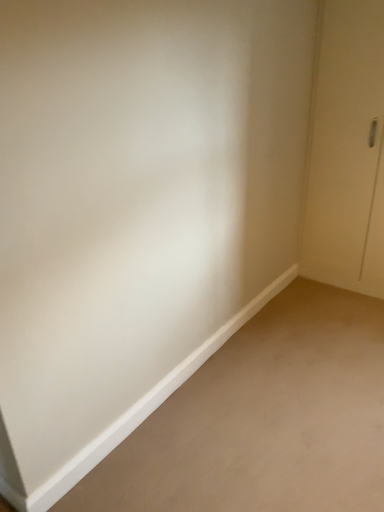
Measure the distance between point (182, 467) and camera.

The depth of point (182, 467) is 5.98 feet.

Locate an element on the screen. white matte baseboard at lower left is located at coordinates (264, 419).

What do you see at coordinates (264, 419) in the screenshot? Image resolution: width=384 pixels, height=512 pixels. I see `white matte baseboard at lower left` at bounding box center [264, 419].

In order to face white matte baseboard at lower left, should I rotate leftwards or rightwards?

You should rotate right by 11.685 degrees.

The image size is (384, 512). What do you see at coordinates (347, 151) in the screenshot?
I see `white matte door at right` at bounding box center [347, 151].

Locate an element on the screen. The image size is (384, 512). white matte door at right is located at coordinates (347, 151).

Locate an element on the screen. Image resolution: width=384 pixels, height=512 pixels. white matte baseboard at lower left is located at coordinates (264, 419).

Considering the relative positions of white matte baseboard at lower left and white matte door at right in the image provided, is white matte baseboard at lower left to the left of white matte door at right from the viewer's perspective?

Correct, you'll find white matte baseboard at lower left to the left of white matte door at right.

Considering the relative positions of white matte baseboard at lower left and white matte door at right in the image provided, is white matte baseboard at lower left in front of white matte door at right?

Yes, white matte baseboard at lower left is closer to the camera.

Considering the points (219, 392) and (373, 70), which point is behind, point (219, 392) or point (373, 70)?

Positioned behind is point (373, 70).

From the image's perspective, is white matte baseboard at lower left below white matte door at right?

Yes, from the image's perspective, white matte baseboard at lower left is beneath white matte door at right.

From a real-world perspective, between white matte baseboard at lower left and white matte door at right, who is vertically lower?

white matte baseboard at lower left, from a real-world perspective.

Between white matte baseboard at lower left and white matte door at right, which one has larger width?

With larger width is white matte baseboard at lower left.

Looking at this image, is white matte baseboard at lower left taller than white matte door at right?

No.

Between white matte baseboard at lower left and white matte door at right, which one has smaller size?

white matte baseboard at lower left.

Is white matte door at right surrounded by white matte baseboard at lower left?

Answer: Actually, white matte door at right is outside white matte baseboard at lower left.

Is white matte baseboard at lower left with white matte door at right?

No, white matte baseboard at lower left is not making contact with white matte door at right.

Is white matte baseboard at lower left aimed at white matte door at right?

No, white matte baseboard at lower left is not facing towards white matte door at right.

The image size is (384, 512). Identify the location of door behind the white matte baseboard at lower left. (347, 151).

Is white matte door at right at the right side of white matte baseboard at lower left?

Yes.

Is white matte door at right in front of or behind white matte baseboard at lower left in the image?

white matte door at right is behind white matte baseboard at lower left.

Which is behind, point (347, 69) or point (138, 459)?

The point (347, 69) is behind.

From the image's perspective, relative to white matte baseboard at lower left, is white matte door at right above or below?

Clearly, from the image's perspective, white matte door at right is above white matte baseboard at lower left.

Consider the image. From a real-world perspective, is white matte door at right physically below white matte baseboard at lower left?

No, from a real-world perspective, white matte door at right is not under white matte baseboard at lower left.

From the picture: Considering the sizes of objects white matte door at right and white matte baseboard at lower left in the image provided, who is wider, white matte door at right or white matte baseboard at lower left?

white matte baseboard at lower left.

Who is taller, white matte door at right or white matte baseboard at lower left?

With more height is white matte door at right.

In terms of size, does white matte door at right appear bigger or smaller than white matte baseboard at lower left?

In the image, white matte door at right appears to be larger than white matte baseboard at lower left.

Is white matte baseboard at lower left located within white matte door at right?

No, white matte baseboard at lower left is not a part of white matte door at right.

Is white matte door at right positioned far away from white matte baseboard at lower left?

Yes.

Does white matte door at right turn towards white matte baseboard at lower left?

Yes, white matte door at right is oriented towards white matte baseboard at lower left.

From the picture: What's the angular difference between white matte door at right and white matte baseboard at lower left's facing directions?

The facing directions of white matte door at right and white matte baseboard at lower left are 90.1 degrees apart.

You are a GUI agent. You are given a task and a screenshot of the screen. Output one action in this format:
    pyautogui.click(x=<x>, y=<y>)
    Task: Click on the door on the right of white matte baseboard at lower left
    The width and height of the screenshot is (384, 512).
    Given the screenshot: What is the action you would take?
    pyautogui.click(x=347, y=151)

Locate an element on the screen. door that appears behind the white matte baseboard at lower left is located at coordinates (347, 151).

The width and height of the screenshot is (384, 512). What are the coordinates of `plain below the white matte door at right (from a real-world perspective)` in the screenshot? It's located at (264, 419).